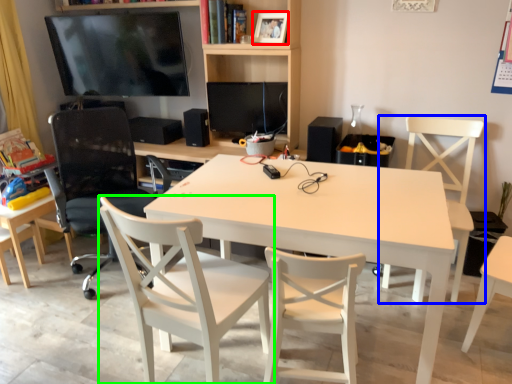
Question: Considering the real-world distances, which object is farthest from picture frame (highlighted by a red box)? chair (highlighted by a blue box) or chair (highlighted by a green box)?

Choices:
 (A) chair
 (B) chair

Answer: (B)